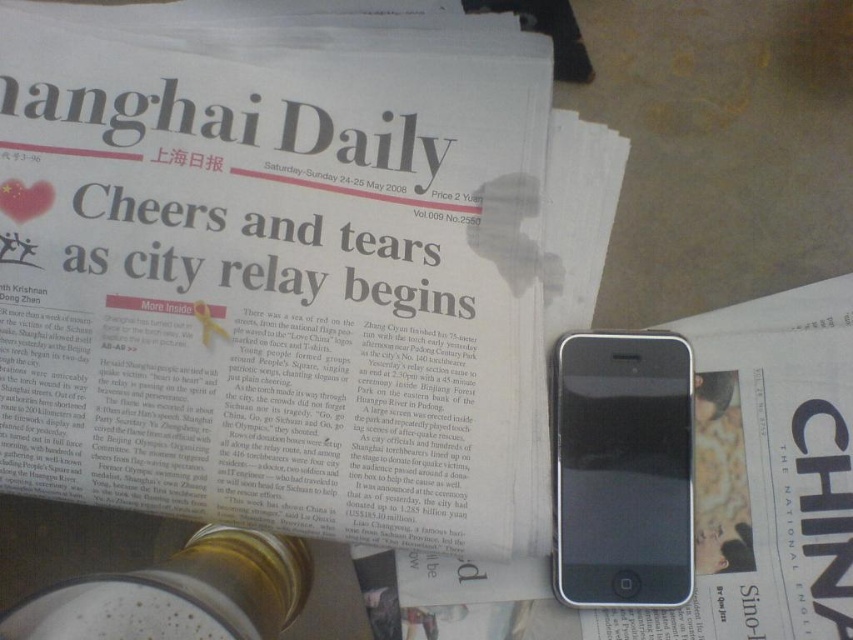
You are organizing a display at a library and have both the white glossy newspaper at upper center and the white glossy paper at center. Since space is limited, you need to know which one takes up more space. Which object is bigger?

The white glossy newspaper at upper center is larger in size than the white glossy paper at center, so it takes up more space.

You are organizing a display for a history exhibition and need to place both the white glossy newspaper at upper center and the black matte smartphone at lower right. Based on their positions in the image, which object should you place to the left side of the display to maintain the original arrangement?

The white glossy newspaper at upper center should be placed to the left side of the display because it is to the left of the black matte smartphone at lower right in the original image.

From the picture: You need to place a 3.5 inch long keychain between the white glossy paper at center and the black matte smartphone at lower right. Is there enough space between them to fit the keychain without moving either item?

The distance between the white glossy paper at center and the black matte smartphone at lower right is 2.52 inches. Since the keychain is 3.5 inches long, it cannot fit in the available space.